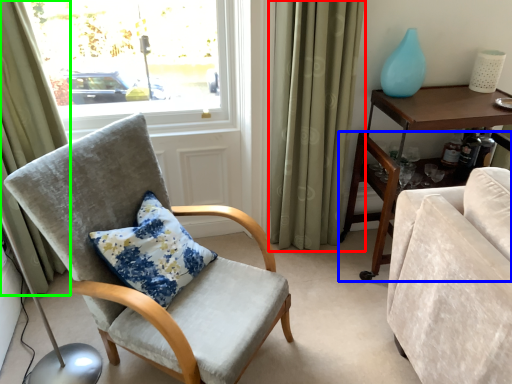
Question: Which object is positioned farthest from curtain (highlighted by a red box)? Select from desk (highlighted by a blue box) and curtain (highlighted by a green box).

Choices:
 (A) desk
 (B) curtain

Answer: (B)